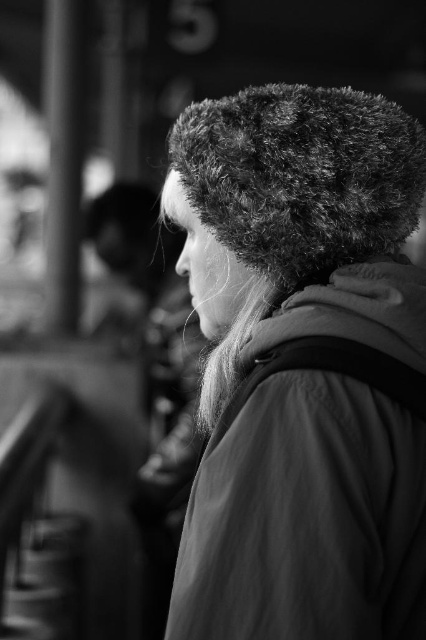
Who is higher up, fuzzy fur hat at center or fuzzy fur hat at upper center?

fuzzy fur hat at upper center is higher up.

How distant is fuzzy fur hat at center from fuzzy fur hat at upper center?

5.14 inches

The width and height of the screenshot is (426, 640). What do you see at coordinates (302, 365) in the screenshot? I see `fuzzy fur hat at center` at bounding box center [302, 365].

You are a GUI agent. You are given a task and a screenshot of the screen. Output one action in this format:
    pyautogui.click(x=<x>, y=<y>)
    Task: Click on the fuzzy fur hat at center
    The height and width of the screenshot is (640, 426).
    Given the screenshot: What is the action you would take?
    pyautogui.click(x=302, y=365)